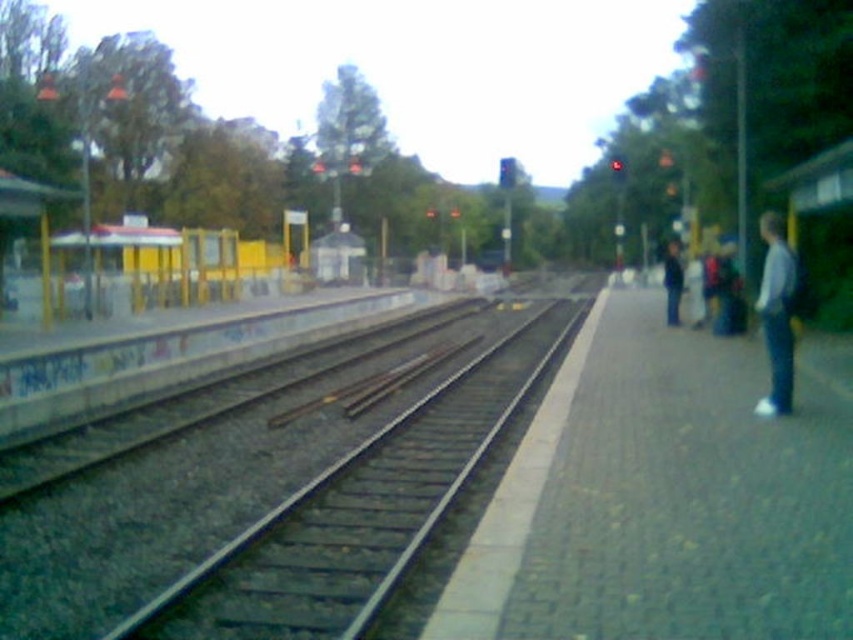
Does brick platform at right have a lesser width compared to white fabric jacket at right?

No.

In the scene shown: Can you confirm if brick platform at right is shorter than white fabric jacket at right?

Incorrect, brick platform at right's height does not fall short of white fabric jacket at right's.

Locate an element on the screen. The image size is (853, 640). brick platform at right is located at coordinates (663, 499).

From the picture: Who is more forward, [213,435] or [781,304]?

Positioned in front is point [781,304].

Can you confirm if smooth metal tracks at center is positioned to the left of white fabric jacket at right?

Indeed, smooth metal tracks at center is positioned on the left side of white fabric jacket at right.

Is point (531, 321) positioned before point (759, 289)?

That is False.

The width and height of the screenshot is (853, 640). Find the location of `smooth metal tracks at center`. smooth metal tracks at center is located at coordinates (277, 493).

Does smooth metal tracks at center appear under brick platform at right?

Correct, smooth metal tracks at center is located below brick platform at right.

Image resolution: width=853 pixels, height=640 pixels. Describe the element at coordinates (277, 493) in the screenshot. I see `smooth metal tracks at center` at that location.

At what (x,y) coordinates should I click in order to perform the action: click on smooth metal tracks at center. Please return your answer as a coordinate pair (x, y). The width and height of the screenshot is (853, 640). Looking at the image, I should click on (277, 493).